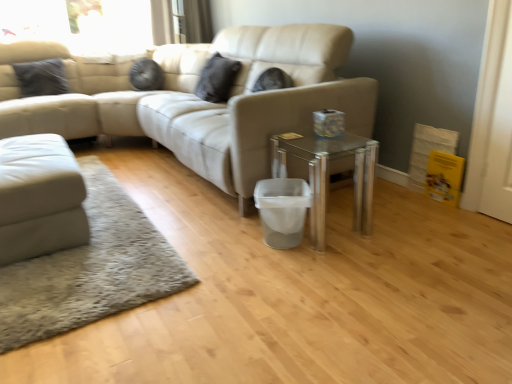
Question: Does white wood screen door at right have a smaller size compared to matte black pillow at upper center, the 2th pillow in the left-to-right sequence?

Choices:
 (A) yes
 (B) no

Answer: (A)

Question: From a real-world perspective, is white wood screen door at right below matte black pillow at upper center, the 2th pillow in the left-to-right sequence?

Choices:
 (A) yes
 (B) no

Answer: (A)

Question: From a real-world perspective, is white wood screen door at right on matte black pillow at upper center, the 2th pillow in the left-to-right sequence?

Choices:
 (A) yes
 (B) no

Answer: (B)

Question: Considering the relative sizes of white wood screen door at right and matte black pillow at upper center, the 2th pillow in the left-to-right sequence, in the image provided, is white wood screen door at right wider than matte black pillow at upper center, the 2th pillow in the left-to-right sequence,?

Choices:
 (A) no
 (B) yes

Answer: (A)

Question: Are white wood screen door at right and matte black pillow at upper center, the 2th pillow in the left-to-right sequence, located far from each other?

Choices:
 (A) no
 (B) yes

Answer: (B)

Question: From their relative heights in the image, would you say white wood screen door at right is taller or shorter than transparent glass table at center?

Choices:
 (A) short
 (B) tall

Answer: (B)

Question: Based on their positions, is white wood screen door at right located to the left or right of transparent glass table at center?

Choices:
 (A) left
 (B) right

Answer: (B)

Question: Does point (485, 59) appear closer or farther from the camera than point (325, 226)?

Choices:
 (A) closer
 (B) farther

Answer: (A)

Question: In terms of size, does white wood screen door at right appear bigger or smaller than transparent glass table at center?

Choices:
 (A) small
 (B) big

Answer: (A)

Question: From their relative heights in the image, would you say matte black pillow at upper center, the 2th pillow in the left-to-right sequence, is taller or shorter than black matte pillow at upper left, which appears as the 1th pillow when viewed from the left?

Choices:
 (A) tall
 (B) short

Answer: (A)

Question: Is matte black pillow at upper center, the 2th pillow in the left-to-right sequence, in front of or behind black matte pillow at upper left, the 2th pillow in the right-to-left sequence, in the image?

Choices:
 (A) front
 (B) behind

Answer: (A)

Question: Is matte black pillow at upper center, marked as the first pillow in a right-to-left arrangement, situated inside black matte pillow at upper left, which appears as the 1th pillow when viewed from the left, or outside?

Choices:
 (A) inside
 (B) outside

Answer: (B)

Question: Looking at their shapes, would you say matte black pillow at upper center, the 2th pillow in the left-to-right sequence, is wider or thinner than black matte pillow at upper left, the 2th pillow in the right-to-left sequence?

Choices:
 (A) wide
 (B) thin

Answer: (B)

Question: Considering their positions, is black matte pillow at upper left, which appears as the 1th pillow when viewed from the left, located in front of or behind matte black pillow at upper center, marked as the first pillow in a right-to-left arrangement?

Choices:
 (A) front
 (B) behind

Answer: (B)

Question: Is black matte pillow at upper left, the 2th pillow in the right-to-left sequence, bigger or smaller than matte black pillow at upper center, marked as the first pillow in a right-to-left arrangement?

Choices:
 (A) small
 (B) big

Answer: (A)